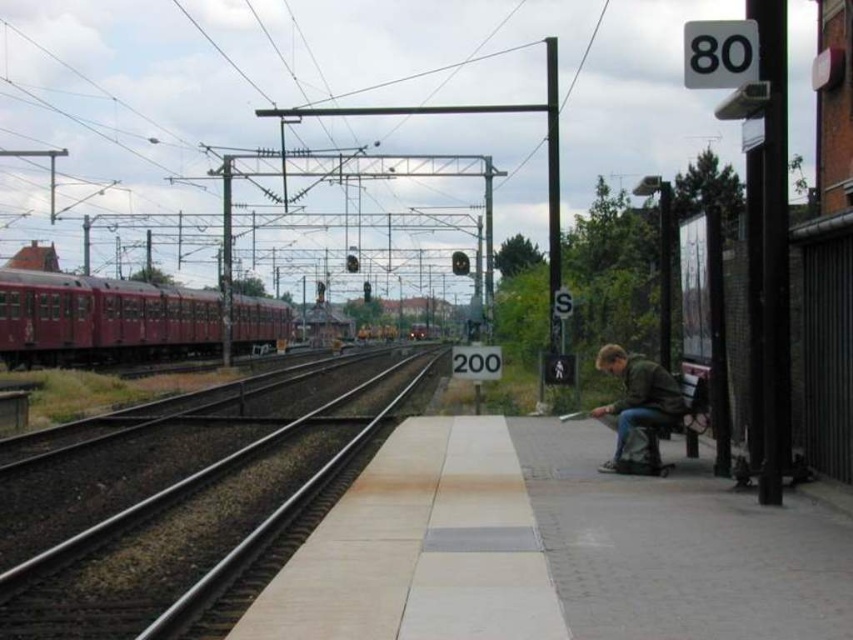
From the picture: Does smooth metal train track at center appear over green matte jacket at lower right?

No, smooth metal train track at center is not above green matte jacket at lower right.

Does smooth metal train track at center appear on the right side of green matte jacket at lower right?

In fact, smooth metal train track at center is to the left of green matte jacket at lower right.

Who is more distant from viewer, [90,593] or [647,372]?

Positioned behind is point [647,372].

Locate an element on the screen. This screenshot has width=853, height=640. smooth metal train track at center is located at coordinates (192, 509).

Is maroon metallic train at left taller than green matte jacket at lower right?

Yes.

Consider the image. Does maroon metallic train at left have a smaller size compared to green matte jacket at lower right?

No.

Between point (67, 289) and point (637, 392), which one is positioned behind?

The point (67, 289) is more distant.

Image resolution: width=853 pixels, height=640 pixels. Find the location of `maroon metallic train at left`. maroon metallic train at left is located at coordinates (102, 320).

Can you confirm if smooth metal train track at center is smaller than maroon metallic train at left?

Yes.

Does smooth metal train track at center have a lesser height compared to maroon metallic train at left?

Yes, smooth metal train track at center is shorter than maroon metallic train at left.

This screenshot has height=640, width=853. Describe the element at coordinates (192, 509) in the screenshot. I see `smooth metal train track at center` at that location.

Where is `smooth metal train track at center`? smooth metal train track at center is located at coordinates (192, 509).